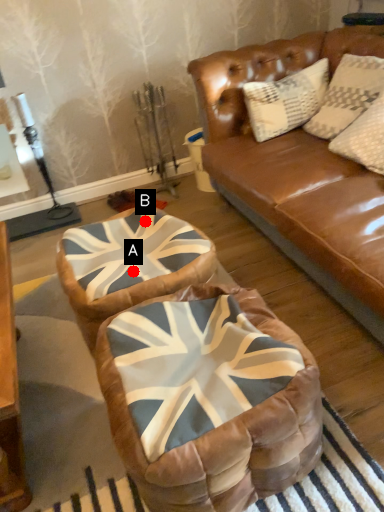
Question: Two points are circled on the image, labeled by A and B beside each circle. Which point is farther to the camera?

Choices:
 (A) A is further
 (B) B is further

Answer: (B)